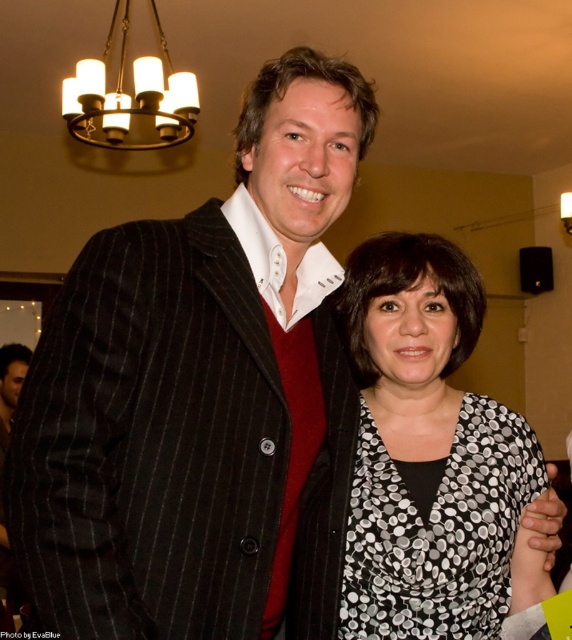
Question: Which point is closer to the camera?

Choices:
 (A) (507, 579)
 (B) (122, 627)
 (C) (172, 99)

Answer: (B)

Question: Is black dotted blouse at center in front of gold metallic chandelier at upper left?

Choices:
 (A) no
 (B) yes

Answer: (B)

Question: Does black pinstripe suit at center appear under gold metallic chandelier at upper left?

Choices:
 (A) no
 (B) yes

Answer: (B)

Question: Can you confirm if black dotted blouse at center is wider than gold metallic chandelier at upper left?

Choices:
 (A) no
 (B) yes

Answer: (A)

Question: Estimate the real-world distances between objects in this image. Which object is farther from the gold metallic chandelier at upper left?

Choices:
 (A) black dotted blouse at center
 (B) black pinstripe suit at center

Answer: (B)

Question: Which of these objects is positioned closest to the black pinstripe suit at center?

Choices:
 (A) black dotted blouse at center
 (B) gold metallic chandelier at upper left

Answer: (A)